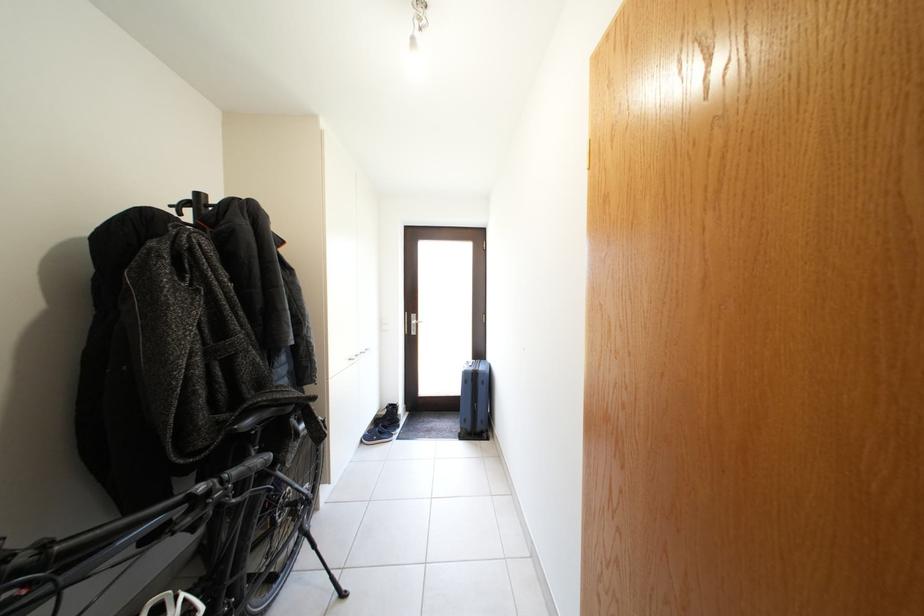
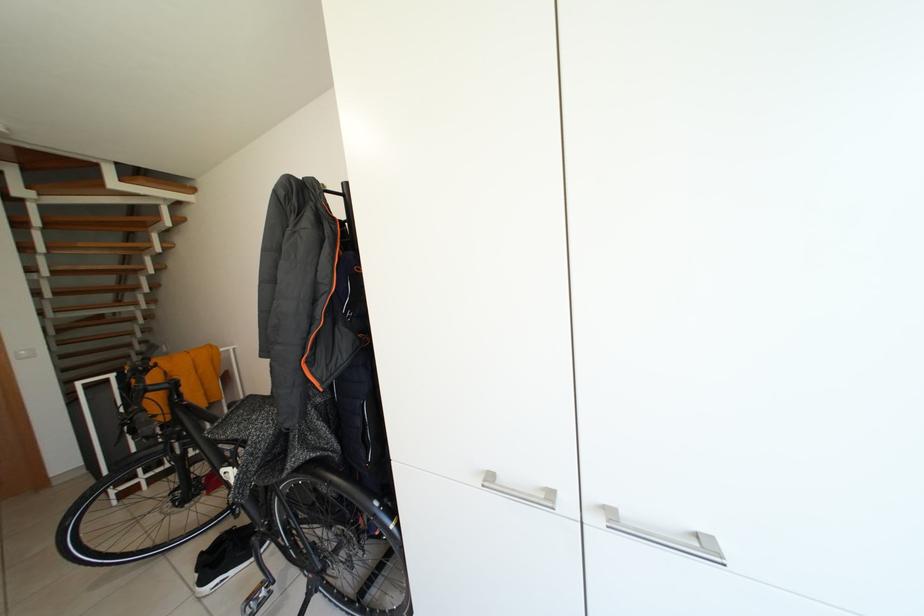
Question: I am providing you with two images of the same scene from different viewpoints. After the viewpoint changes to image2, which objects are now occluded?

Choices:
 (A) red box handle
 (B) bicycle handlebar grip
 (C) bicycle saddle
 (D) black coat hook

Answer: (D)